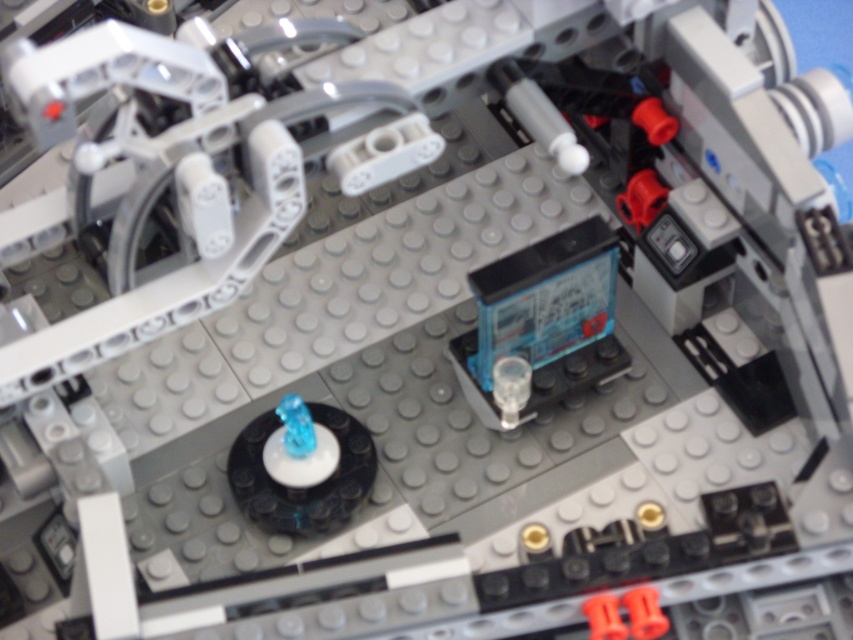
Question: Is blue plastic battery at center thinner than translucent blue plastic bear at center?

Choices:
 (A) yes
 (B) no

Answer: (B)

Question: Is blue plastic battery at center positioned at the back of translucent blue plastic bear at center?

Choices:
 (A) yes
 (B) no

Answer: (A)

Question: Among these objects, which one is nearest to the camera?

Choices:
 (A) translucent blue plastic bear at center
 (B) blue plastic battery at center

Answer: (A)

Question: Among these points, which one is farthest from the camera?

Choices:
 (A) (589, 244)
 (B) (374, 476)

Answer: (B)

Question: Does blue plastic battery at center have a smaller size compared to translucent blue plastic bear at center?

Choices:
 (A) yes
 (B) no

Answer: (B)